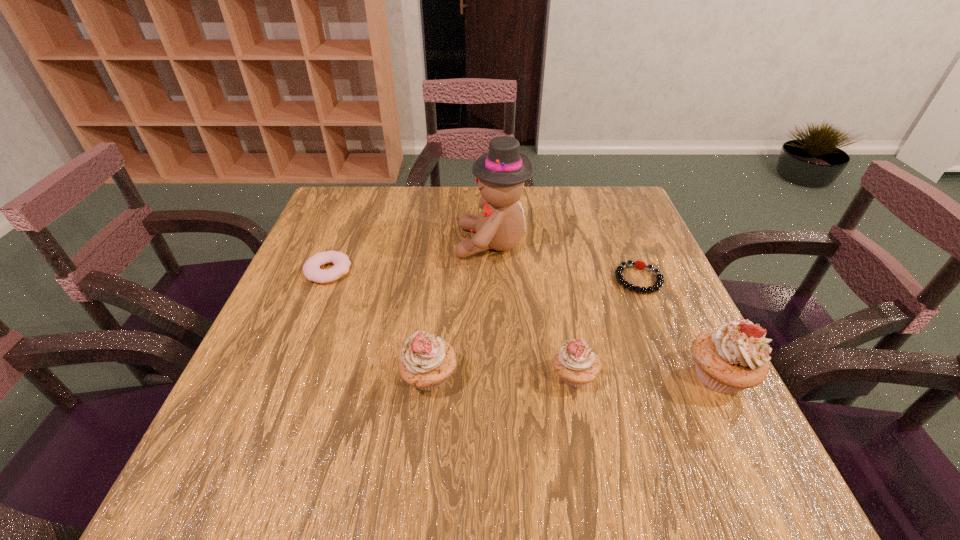
Locate an element on the screen. This screenshot has width=960, height=540. the third tallest object is located at coordinates coord(426,362).

I want to click on the second tallest cupcake, so click(x=426, y=362).

At what (x,y) coordinates should I click in order to perform the action: click on the shortest cupcake. Please return your answer as a coordinate pair (x, y). Looking at the image, I should click on tap(576, 364).

At what (x,y) coordinates should I click in order to perform the action: click on the fourth tallest object. Please return your answer as a coordinate pair (x, y). Looking at the image, I should click on (576, 364).

Locate an element on the screen. the tallest cupcake is located at coordinates (733, 357).

The width and height of the screenshot is (960, 540). I want to click on the rightmost cupcake, so click(733, 357).

Where is `the tallest object`? the tallest object is located at coordinates (501, 172).

This screenshot has width=960, height=540. Identify the location of the shortest object. (659, 282).

The height and width of the screenshot is (540, 960). Identify the location of the leftmost object. (311, 269).

The width and height of the screenshot is (960, 540). What are the coordinates of `the second shortest object` in the screenshot? It's located at (311, 269).